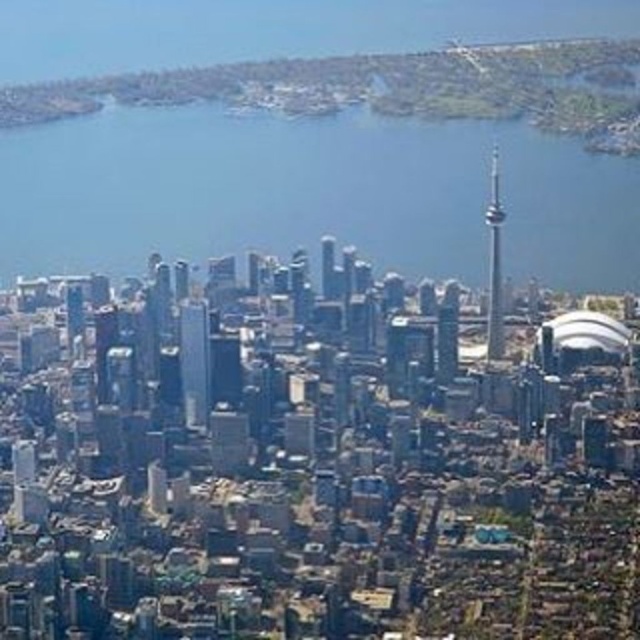
Question: Which object appears closest to the camera in this image?

Choices:
 (A) smooth glass tower at center
 (B) metallic glass skyscraper at center
 (C) glassy reflective skyscraper at center
 (D) blue water at center

Answer: (C)

Question: Does smooth glass tower at center have a greater width compared to glassy reflective skyscraper at center?

Choices:
 (A) no
 (B) yes

Answer: (B)

Question: Which object appears farthest from the camera in this image?

Choices:
 (A) blue water at center
 (B) metallic glass skyscraper at center

Answer: (B)

Question: Is metallic glass skyscraper at center below glassy reflective skyscraper at center?

Choices:
 (A) no
 (B) yes

Answer: (B)

Question: Can you confirm if blue water at center is wider than metallic glass skyscraper at center?

Choices:
 (A) no
 (B) yes

Answer: (B)

Question: Considering the real-world distances, which object is farthest from the metallic glass skyscraper at center?

Choices:
 (A) glassy reflective skyscraper at center
 (B) smooth glass tower at center

Answer: (B)